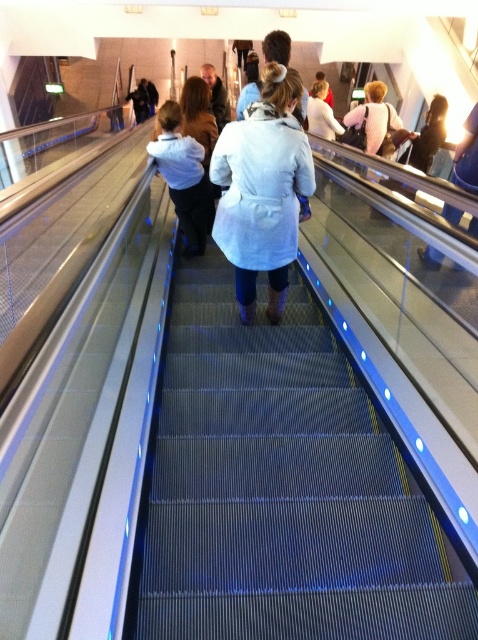
Consider the image. You are standing at the bottom of the escalator and want to hand a package to the person wearing the light brown leather jacket at upper center. The package is 15 feet long. Can you reach them by placing the package on the metallic escalator steps at center?

The metallic escalator steps at center is 15.15 feet away from the light brown leather jacket at upper center. Since the package is 15 feet long, it can reach the distance between them, so yes, you can place the package on the metallic escalator steps at center to reach the person.

You are standing on the metallic escalator steps at center and notice a dark brown leather jacket at upper right. Which object is wider?

The metallic escalator steps at center are wider than the dark brown leather jacket at upper right.